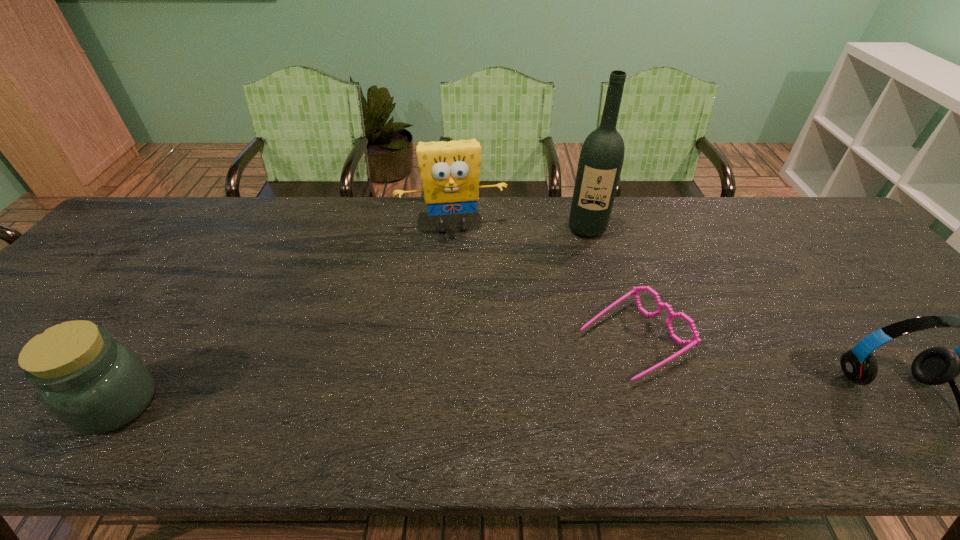
The image size is (960, 540). I want to click on the leftmost object, so click(x=94, y=385).

Where is `the tallest object`? the tallest object is located at coordinates (602, 154).

What are the coordinates of `spectacles` in the screenshot? It's located at (696, 340).

Find the location of a particular element. The height and width of the screenshot is (540, 960). the fourth object from right to left is located at coordinates (450, 171).

You are a GUI agent. You are given a task and a screenshot of the screen. Output one action in this format:
    pyautogui.click(x=<x>, y=<y>)
    Task: Click on the fourth shortest object
    This screenshot has height=540, width=960.
    Given the screenshot: What is the action you would take?
    pyautogui.click(x=450, y=171)

This screenshot has height=540, width=960. Find the location of `free region located on the left of the jar`. free region located on the left of the jar is located at coordinates (32, 403).

What are the coordinates of `vacant space located on the labeled side of the wine bottle` in the screenshot? It's located at (582, 336).

You are a GUI agent. You are given a task and a screenshot of the screen. Output one action in this format:
    pyautogui.click(x=<x>, y=<y>)
    Task: Click on the vacant area located on the labeled side of the wine bottle
    Image resolution: width=960 pixels, height=540 pixels.
    Given the screenshot: What is the action you would take?
    pos(585,274)

You are a GUI agent. You are given a task and a screenshot of the screen. Output one action in this format:
    pyautogui.click(x=<x>, y=<y>)
    Task: Click on the vacant space located 0.170m on the labeled side of the wine bottle
    The width and height of the screenshot is (960, 540).
    Given the screenshot: What is the action you would take?
    pyautogui.click(x=585, y=279)

Identify the location of vacant space located 0.150m on the arms of the shortest object. The image size is (960, 540). (540, 395).